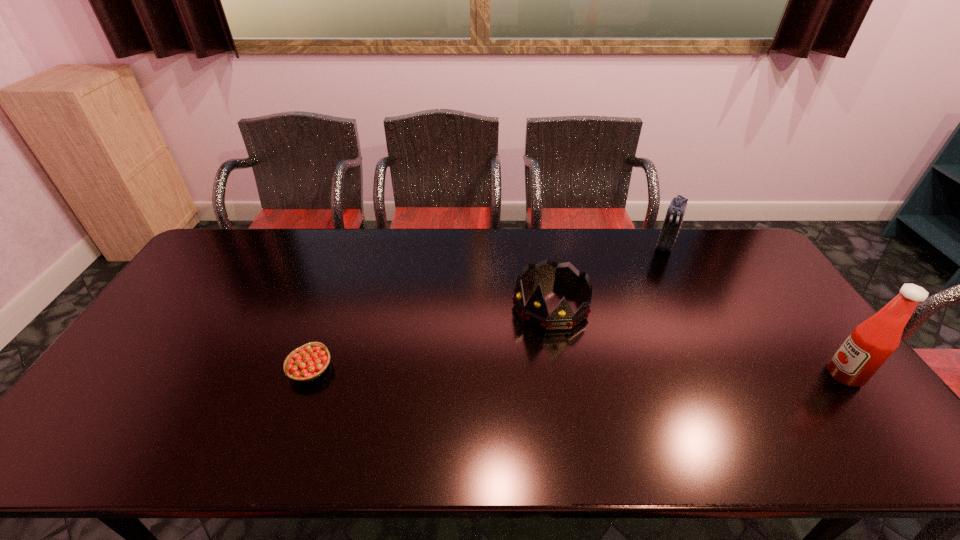
You are a GUI agent. You are given a task and a screenshot of the screen. Output one action in this format:
    pyautogui.click(x=<x>, y=<y>)
    Task: Click on the free space between the third object from left to right and the shortest object
    Image resolution: width=960 pixels, height=540 pixels.
    Given the screenshot: What is the action you would take?
    pyautogui.click(x=488, y=308)

At what (x,y) coordinates should I click in order to perform the action: click on free space between the farthest object and the leftmost object. Please return your answer as a coordinate pair (x, y). Image resolution: width=960 pixels, height=540 pixels. Looking at the image, I should click on (488, 308).

What are the coordinates of `vacant area that lies between the shortest object and the clutch bag` in the screenshot? It's located at (488, 308).

Find the location of a particular element. The height and width of the screenshot is (540, 960). free spot between the third object from left to right and the leftmost object is located at coordinates (488, 308).

This screenshot has width=960, height=540. What are the coordinates of `vacant area that lies between the strawberry and the second object from left to right` in the screenshot? It's located at (431, 337).

You are a GUI agent. You are given a task and a screenshot of the screen. Output one action in this format:
    pyautogui.click(x=<x>, y=<y>)
    Task: Click on the vacant space that is in between the third nearest object and the leftmost object
    The width and height of the screenshot is (960, 540).
    Given the screenshot: What is the action you would take?
    pyautogui.click(x=431, y=337)

Select which object is the second closest to the shortest object. Please provide its 2D coordinates. Your answer should be formatted as a tuple, i.e. [(x, y)], where the tuple contains the x and y coordinates of a point satisfying the conditions above.

[(675, 213)]

Identify which object is the third nearest to the leftmost object. Please provide its 2D coordinates. Your answer should be formatted as a tuple, i.e. [(x, y)], where the tuple contains the x and y coordinates of a point satisfying the conditions above.

[(871, 343)]

At what (x,y) coordinates should I click in order to perform the action: click on vacant position in the image that satisfies the following two spatial constraints: 1. on the front side of the rightmost object; 2. on the front-facing side of the third object from left to right. Please return your answer as a coordinate pair (x, y). The image size is (960, 540). Looking at the image, I should click on (732, 375).